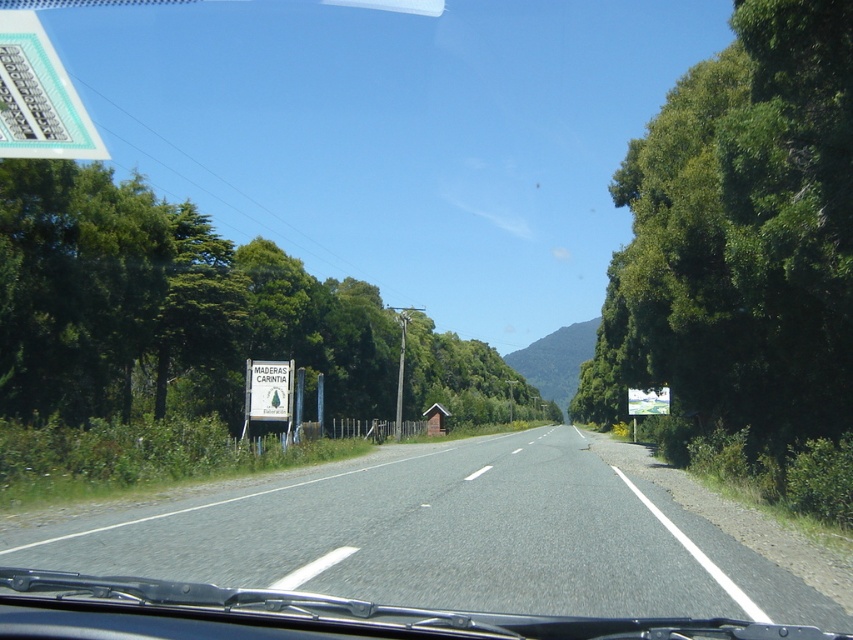
Who is positioned more to the right, green leafy tree at right or green leafy tree at left?

From the viewer's perspective, green leafy tree at right appears more on the right side.

The height and width of the screenshot is (640, 853). I want to click on green leafy tree at right, so point(740,240).

Which of these two, green leafy tree at left or green plastic sign at upper left, stands shorter?

green plastic sign at upper left is shorter.

Who is more forward, (289,284) or (33,134)?

Point (33,134) is more forward.

Between point (192, 298) and point (27, 36), which one is positioned behind?

The point (192, 298) is more distant.

Where is `green leafy tree at left`? The width and height of the screenshot is (853, 640). green leafy tree at left is located at coordinates (163, 307).

Which of these two, green leafy tree at right or white plastic sign at center, stands taller?

green leafy tree at right

Can you confirm if green leafy tree at right is taller than white plastic sign at center?

Yes, green leafy tree at right is taller than white plastic sign at center.

Which is in front, point (813, 44) or point (268, 388)?

Positioned in front is point (813, 44).

Find the location of a particular element. green leafy tree at right is located at coordinates (740, 240).